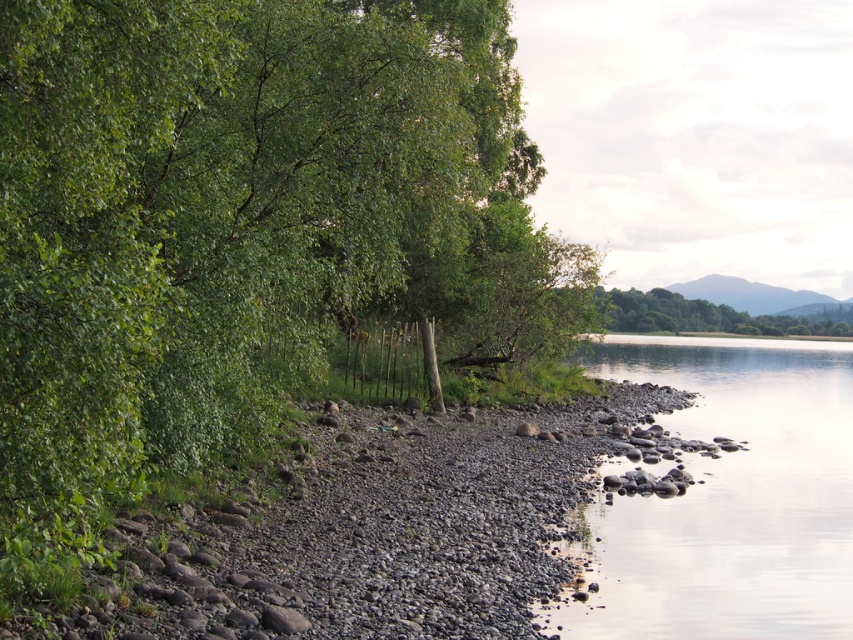
Question: Does green leafy tree at left appear on the left side of smooth stone river at lower right?

Choices:
 (A) yes
 (B) no

Answer: (A)

Question: Which of the following is the closest to the observer?

Choices:
 (A) smooth gravel river bank at center
 (B) green leafy tree at upper right
 (C) smooth stone river at lower right
 (D) green leafy tree at left

Answer: (D)

Question: Among these objects, which one is farthest from the camera?

Choices:
 (A) green leafy tree at upper right
 (B) green leafy tree at left

Answer: (A)

Question: Estimate the real-world distances between objects in this image. Which object is closer to the green leafy tree at left?

Choices:
 (A) green leafy tree at upper right
 (B) smooth gravel river bank at center
 (C) smooth stone river at lower right

Answer: (B)

Question: Is smooth stone river at lower right bigger than green leafy tree at upper right?

Choices:
 (A) yes
 (B) no

Answer: (B)

Question: Can you confirm if green leafy tree at left is positioned to the left of smooth gravel river bank at center?

Choices:
 (A) no
 (B) yes

Answer: (B)